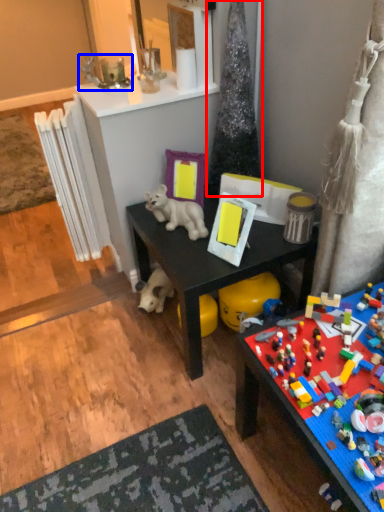
Question: Which object appears closest to the camera in this image, christmas tree (highlighted by a red box) or toy (highlighted by a blue box)?

Choices:
 (A) christmas tree
 (B) toy

Answer: (A)